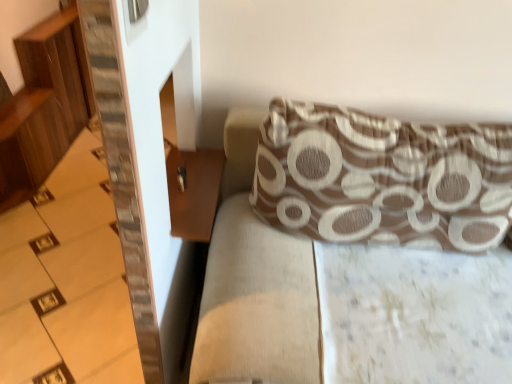
Question: Can you confirm if brown wooden table at lower left is shorter than brown textured cushion at upper right?

Choices:
 (A) yes
 (B) no

Answer: (A)

Question: Does brown wooden table at lower left have a smaller size compared to brown textured cushion at upper right?

Choices:
 (A) yes
 (B) no

Answer: (A)

Question: Can you confirm if brown wooden table at lower left is wider than brown textured cushion at upper right?

Choices:
 (A) no
 (B) yes

Answer: (A)

Question: From a real-world perspective, is brown wooden table at lower left beneath brown textured cushion at upper right?

Choices:
 (A) yes
 (B) no

Answer: (B)

Question: Could brown textured cushion at upper right be considered to be inside brown wooden table at lower left?

Choices:
 (A) yes
 (B) no

Answer: (B)

Question: Is brown wooden table at lower left positioned far away from brown textured cushion at upper right?

Choices:
 (A) yes
 (B) no

Answer: (B)

Question: Is brown textured pillow at upper right shorter than brown textured cushion at upper right?

Choices:
 (A) no
 (B) yes

Answer: (B)

Question: Is brown textured pillow at upper right turned away from brown textured cushion at upper right?

Choices:
 (A) yes
 (B) no

Answer: (A)

Question: From the image's perspective, does brown textured pillow at upper right appear higher than brown textured cushion at upper right?

Choices:
 (A) no
 (B) yes

Answer: (B)

Question: Does brown textured pillow at upper right turn towards brown textured cushion at upper right?

Choices:
 (A) no
 (B) yes

Answer: (B)

Question: Is brown textured pillow at upper right further to camera compared to brown textured cushion at upper right?

Choices:
 (A) yes
 (B) no

Answer: (A)

Question: Can you confirm if brown textured pillow at upper right is taller than brown textured cushion at upper right?

Choices:
 (A) no
 (B) yes

Answer: (A)

Question: Does brown textured pillow at upper right touch wooden stairs at left?

Choices:
 (A) yes
 (B) no

Answer: (B)